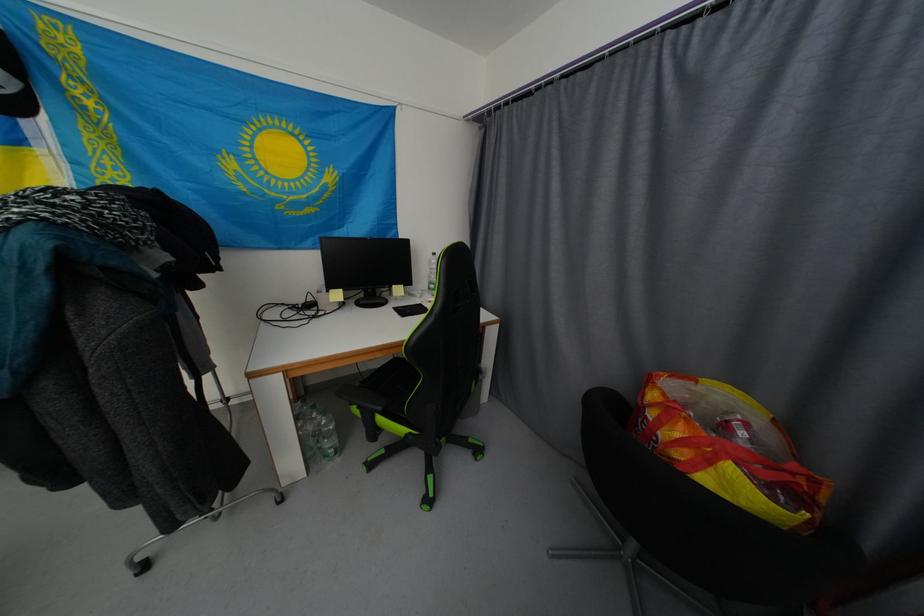
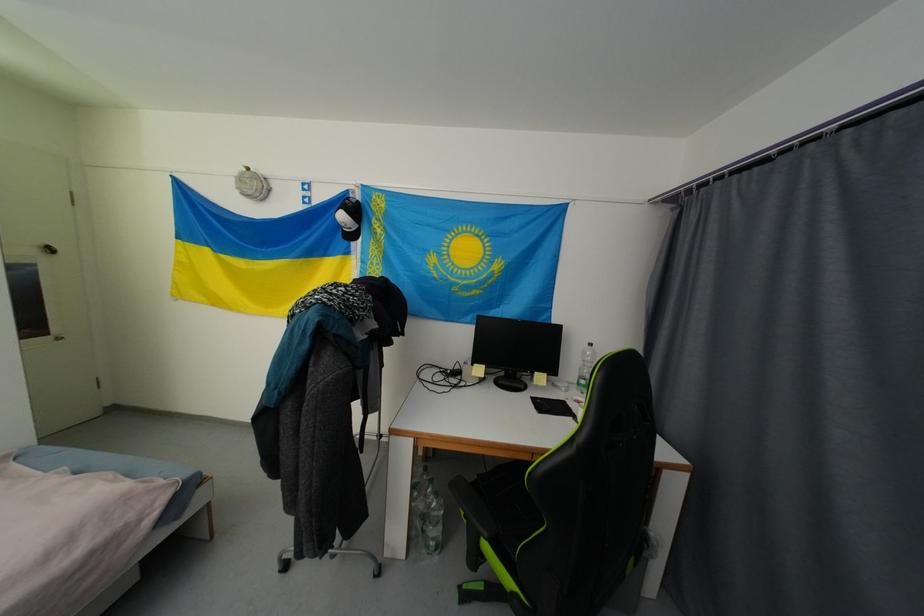
Find the pixel in the second image that matches point (434, 291) in the first image.

(584, 386)